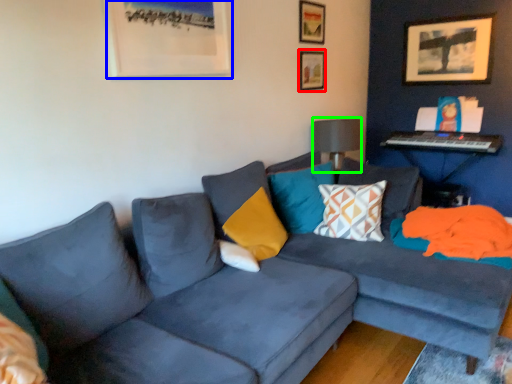
Question: Considering the real-world distances, which object is farthest from picture frame (highlighted by a red box)? picture frame (highlighted by a blue box) or lamp (highlighted by a green box)?

Choices:
 (A) picture frame
 (B) lamp

Answer: (A)